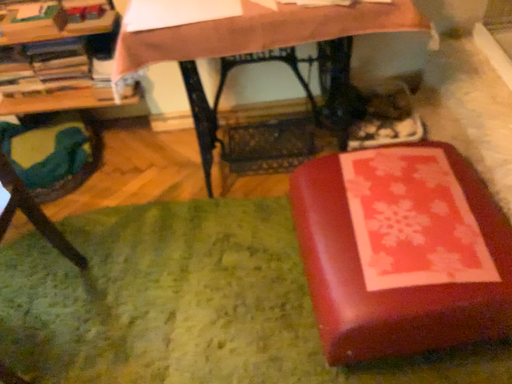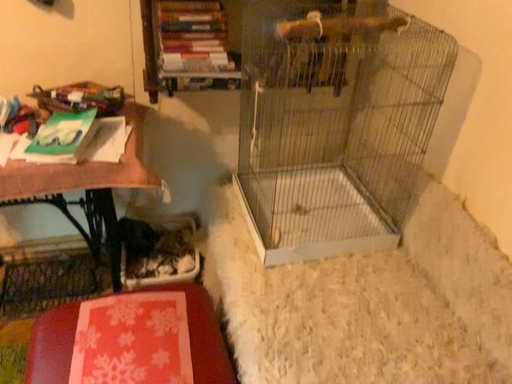
Question: How did the camera likely rotate when shooting the video?

Choices:
 (A) rotated upward
 (B) rotated downward

Answer: (A)